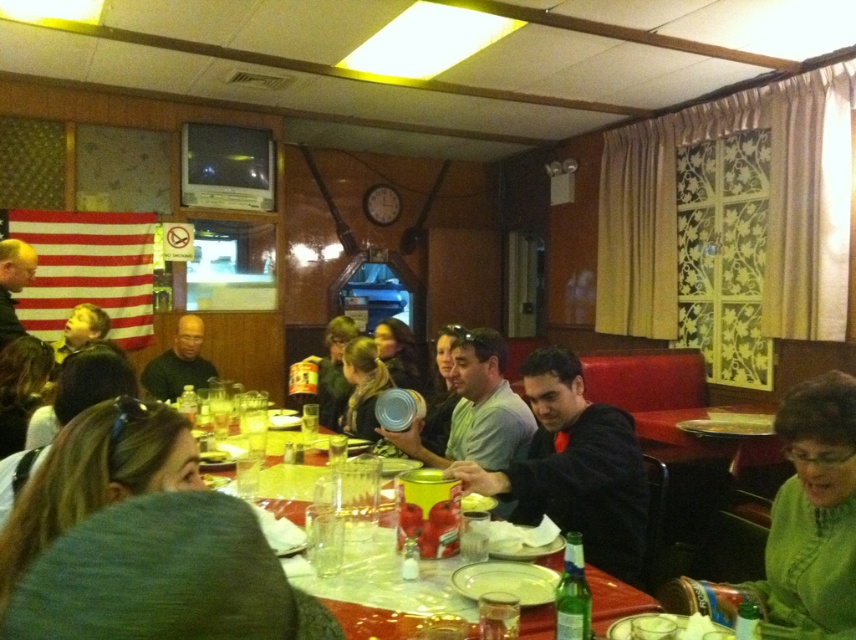
Does black matte jacket at center appear over smooth leather jacket at upper left?

Incorrect, black matte jacket at center is not positioned above smooth leather jacket at upper left.

Is black matte jacket at center closer to the viewer compared to smooth leather jacket at upper left?

That is True.

Which is in front, point (635, 556) or point (0, 305)?

Point (635, 556) is more forward.

You are a GUI agent. You are given a task and a screenshot of the screen. Output one action in this format:
    pyautogui.click(x=<x>, y=<y>)
    Task: Click on the black matte jacket at center
    
    Given the screenshot: What is the action you would take?
    pyautogui.click(x=574, y=467)

Who is higher up, matte silver can at center or matte black can at center?

matte black can at center is above.

Can you confirm if matte silver can at center is positioned to the left of matte black can at center?

In fact, matte silver can at center is to the right of matte black can at center.

Is point (432, 464) less distant than point (382, 326)?

Yes.

You are a GUI agent. You are given a task and a screenshot of the screen. Output one action in this format:
    pyautogui.click(x=<x>, y=<y>)
    Task: Click on the matte silver can at center
    This screenshot has height=640, width=856.
    Given the screenshot: What is the action you would take?
    pyautogui.click(x=474, y=410)

Is matte silver can at center positioned behind matte black hair at center?

No, matte silver can at center is closer to the viewer.

Can you confirm if matte silver can at center is bigger than matte black hair at center?

Yes.

Between point (438, 460) and point (346, 428), which one is positioned behind?

Positioned behind is point (346, 428).

The width and height of the screenshot is (856, 640). Find the location of `matte silver can at center`. matte silver can at center is located at coordinates (474, 410).